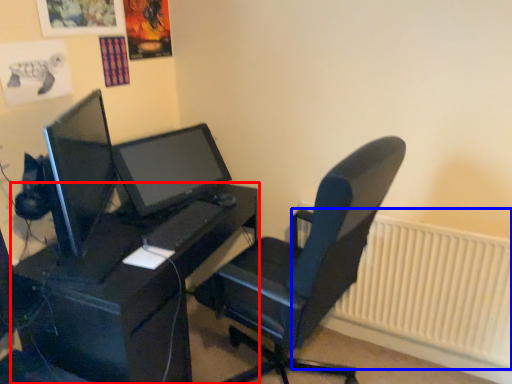
Question: Which object appears closest to the camera in this image, desk (highlighted by a red box) or radiator (highlighted by a blue box)?

Choices:
 (A) desk
 (B) radiator

Answer: (A)